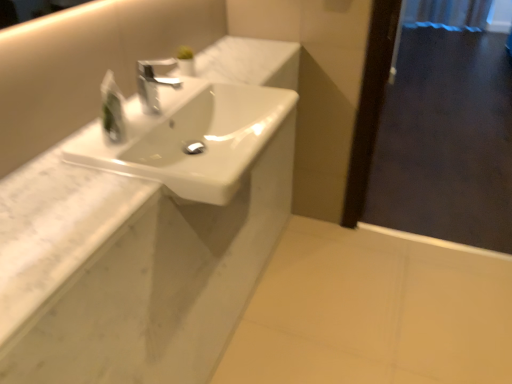
Question: Does white marble counter at upper left have a larger size compared to white glossy sink at center?

Choices:
 (A) yes
 (B) no

Answer: (B)

Question: Is white marble counter at upper left looking in the opposite direction of white glossy sink at center?

Choices:
 (A) no
 (B) yes

Answer: (B)

Question: From the image's perspective, does white marble counter at upper left appear lower than white glossy sink at center?

Choices:
 (A) yes
 (B) no

Answer: (B)

Question: Could white glossy sink at center be considered to be inside white marble counter at upper left?

Choices:
 (A) no
 (B) yes

Answer: (A)

Question: Is white marble counter at upper left aimed at white glossy sink at center?

Choices:
 (A) yes
 (B) no

Answer: (A)

Question: Would you say translucent plastic soap dispenser at upper left is to the left or to the right of white marble counter at upper left in the picture?

Choices:
 (A) left
 (B) right

Answer: (A)

Question: From their relative heights in the image, would you say translucent plastic soap dispenser at upper left is taller or shorter than white marble counter at upper left?

Choices:
 (A) tall
 (B) short

Answer: (A)

Question: Is translucent plastic soap dispenser at upper left in front of or behind white marble counter at upper left in the image?

Choices:
 (A) behind
 (B) front

Answer: (A)

Question: Looking at the image, does translucent plastic soap dispenser at upper left seem bigger or smaller compared to white marble counter at upper left?

Choices:
 (A) small
 (B) big

Answer: (A)

Question: Is point (454, 132) positioned closer to the camera than point (160, 130)?

Choices:
 (A) closer
 (B) farther

Answer: (B)

Question: Considering their positions, is transparent glass screen door at right located in front of or behind white glossy sink at center?

Choices:
 (A) behind
 (B) front

Answer: (A)

Question: From their relative heights in the image, would you say transparent glass screen door at right is taller or shorter than white glossy sink at center?

Choices:
 (A) tall
 (B) short

Answer: (A)

Question: From a real-world perspective, is transparent glass screen door at right positioned above or below white glossy sink at center?

Choices:
 (A) above
 (B) below

Answer: (B)

Question: Is point (152, 81) positioned closer to the camera than point (117, 130)?

Choices:
 (A) farther
 (B) closer

Answer: (A)

Question: Based on their sizes in the image, would you say satin nickel faucet at center is bigger or smaller than translucent plastic soap dispenser at upper left?

Choices:
 (A) big
 (B) small

Answer: (A)